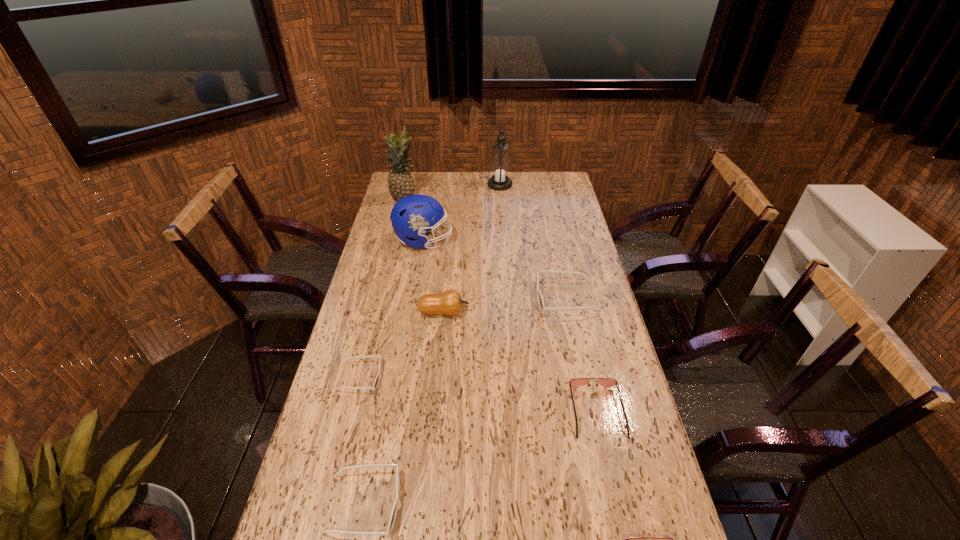
The height and width of the screenshot is (540, 960). Find the location of `pineapple present at the left edge`. pineapple present at the left edge is located at coordinates (x=400, y=181).

At what (x,y) coordinates should I click in order to perform the action: click on football helmet that is at the left edge. Please return your answer as a coordinate pair (x, y). Image resolution: width=960 pixels, height=540 pixels. Looking at the image, I should click on (412, 216).

You are a GUI agent. You are given a task and a screenshot of the screen. Output one action in this format:
    pyautogui.click(x=<x>, y=<y>)
    Task: Click on the sunglasses present at the left edge
    The height and width of the screenshot is (540, 960).
    Given the screenshot: What is the action you would take?
    pyautogui.click(x=376, y=381)

Where is `object that is positioned at the far left corner`? The width and height of the screenshot is (960, 540). object that is positioned at the far left corner is located at coordinates (400, 181).

Find the location of `vacant space at the far edge of the desktop`. vacant space at the far edge of the desktop is located at coordinates (471, 186).

Identify the location of free space at the left edge of the desktop. (311, 537).

This screenshot has width=960, height=540. I want to click on vacant space at the right edge of the desktop, so click(x=570, y=294).

Where is `vacant region at the far right corner of the desktop`? vacant region at the far right corner of the desktop is located at coordinates (569, 192).

Find the location of a particular element. vacant point located between the bigger pink sunglasses and the smallest black sunglasses is located at coordinates (478, 394).

Where is `blank region between the fourth tallest object and the green pineapple`? This screenshot has height=540, width=960. blank region between the fourth tallest object and the green pineapple is located at coordinates (424, 255).